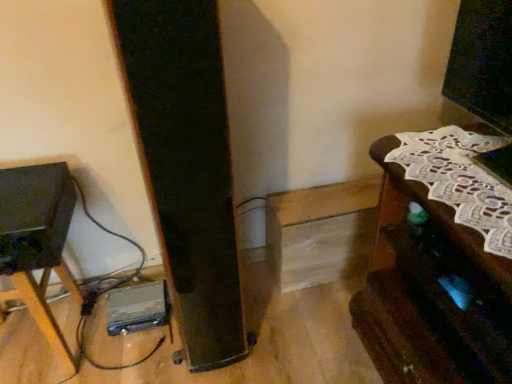
What are the coordinates of `free space underneath metallic silver tripod at lower left, the 2th furniture viewed from the right (from a real-world perspective)` in the screenshot? It's located at (31, 344).